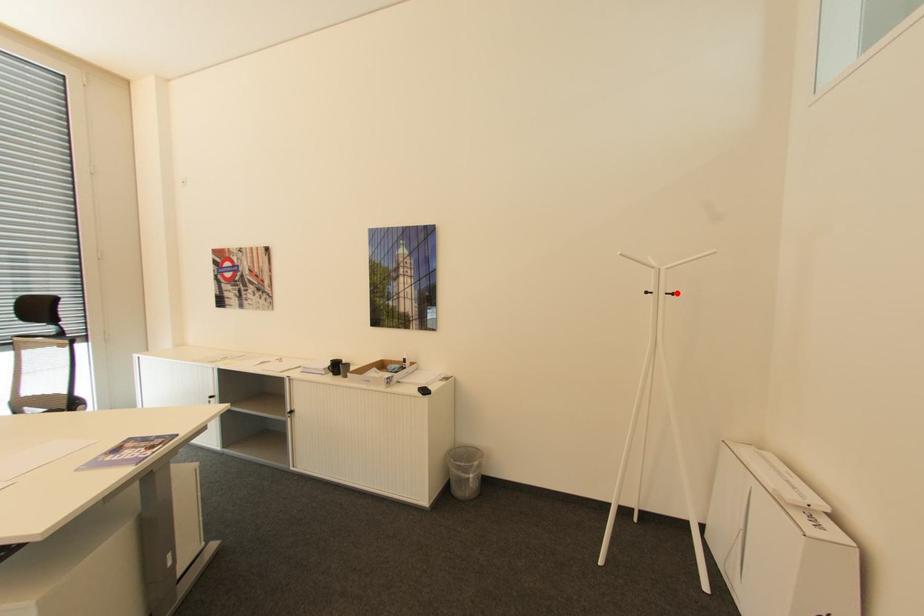
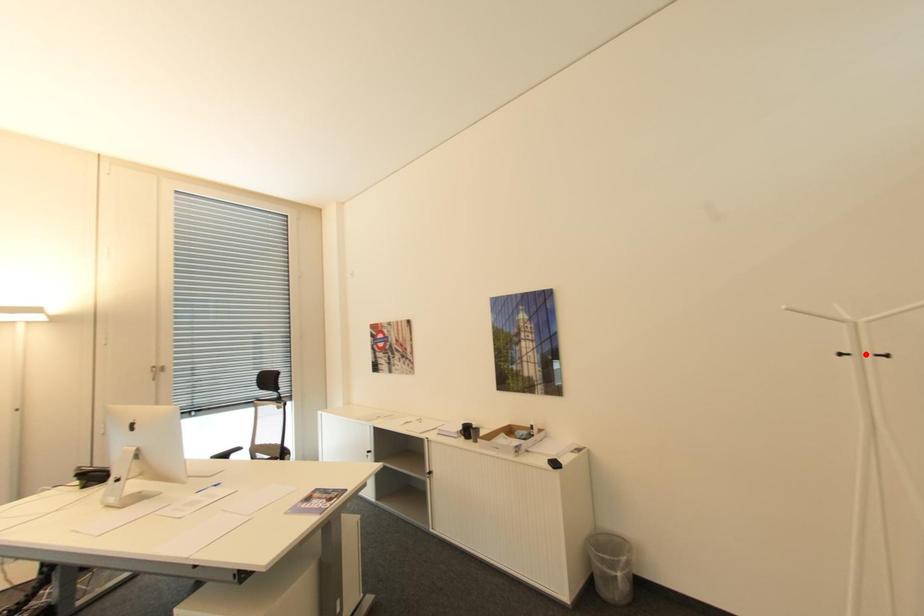
I am providing you with two images of the same scene from different viewpoints. A red point is marked on the first image and another point is marked on the second image. Do the highlighted points in image1 and image2 indicate the same real-world spot?

No